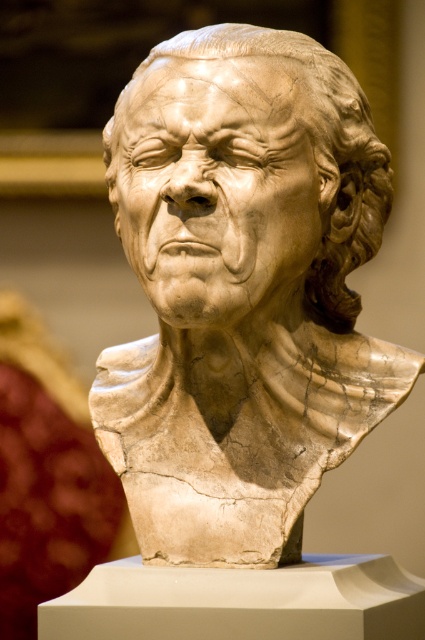
You are an art conservator examining the marble bust sculpture. You notice two points on the sculpture marked as point 1 at coordinates point (246, 228) and point 2 at coordinates point (374, 145). Which point is closer to the viewer?

Point (246, 228) is in front of point (374, 145), so point 1 is closer to the viewer.

You are a photographer standing at a certain position and want to capture a closeup shot of the white marble bust at center. Your camera has a minimum focusing distance of 2 meters. Can you take the photo without moving closer?

The white marble bust at center and camera are 1.97 meters apart from each other. Since the minimum focusing distance is 2 meters, the camera is slightly closer than required. You need to move back to at least 2 meters to focus properly.